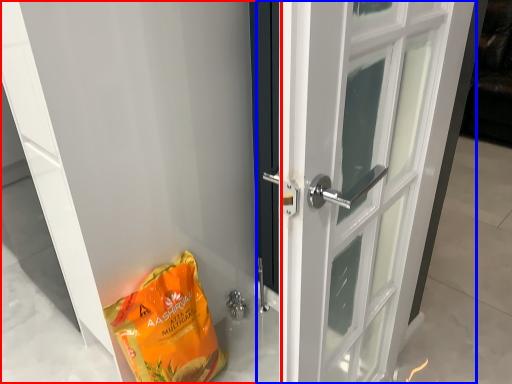
Question: Which object is closer to the camera taking this photo, door (highlighted by a red box) or door (highlighted by a blue box)?

Choices:
 (A) door
 (B) door

Answer: (A)